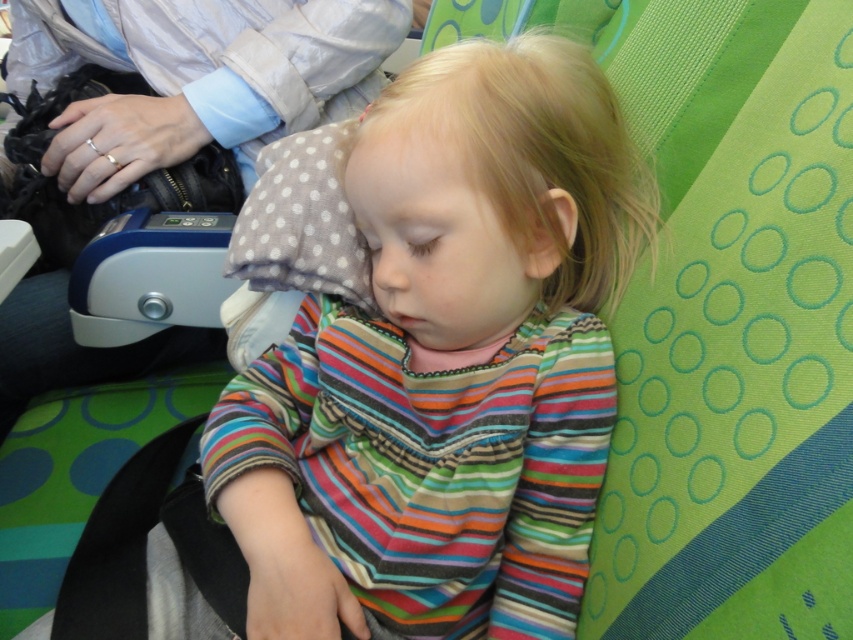
Question: Which point appears farthest from the camera in this image?

Choices:
 (A) (274, 237)
 (B) (511, 371)

Answer: (A)

Question: Is striped cotton shirt at center behind gray dotted pillow at center?

Choices:
 (A) no
 (B) yes

Answer: (A)

Question: Does striped cotton shirt at center appear over gray dotted pillow at center?

Choices:
 (A) no
 (B) yes

Answer: (A)

Question: Which point appears closest to the camera in this image?

Choices:
 (A) (567, 157)
 (B) (265, 177)

Answer: (A)

Question: Which point is closer to the camera taking this photo?

Choices:
 (A) (302, 440)
 (B) (260, 188)

Answer: (A)

Question: Is striped cotton shirt at center closer to camera compared to gray dotted pillow at center?

Choices:
 (A) yes
 (B) no

Answer: (A)